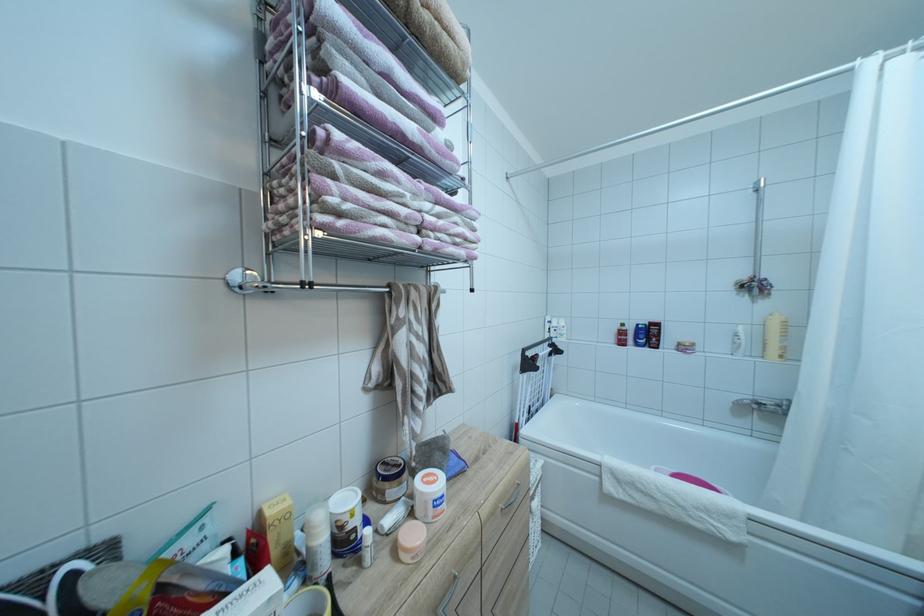
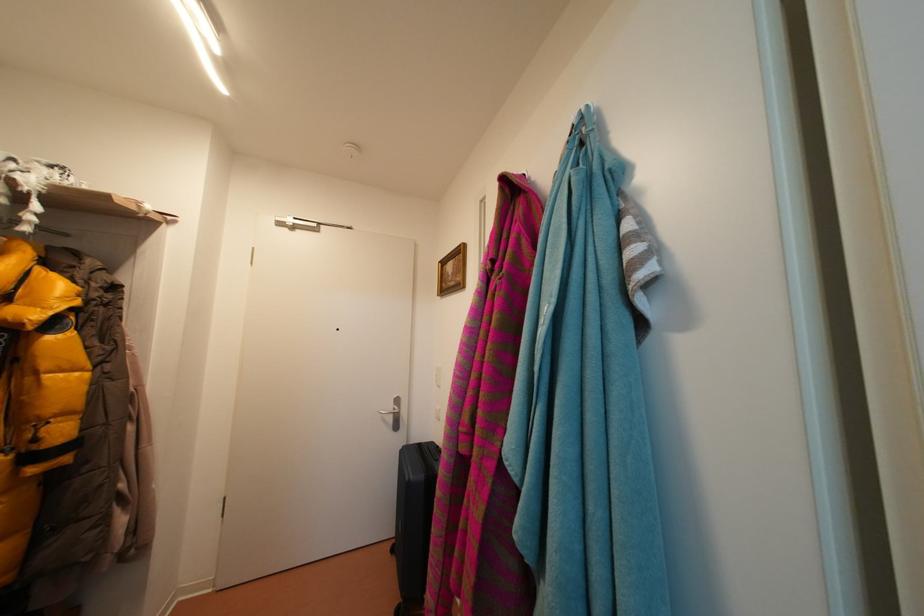
Question: Based on the continuous images, in which direction is the camera rotating? Reply with the corresponding letter.

Choices:
 (A) Left
 (B) Right
 (C) Up
 (D) Down

Answer: (A)